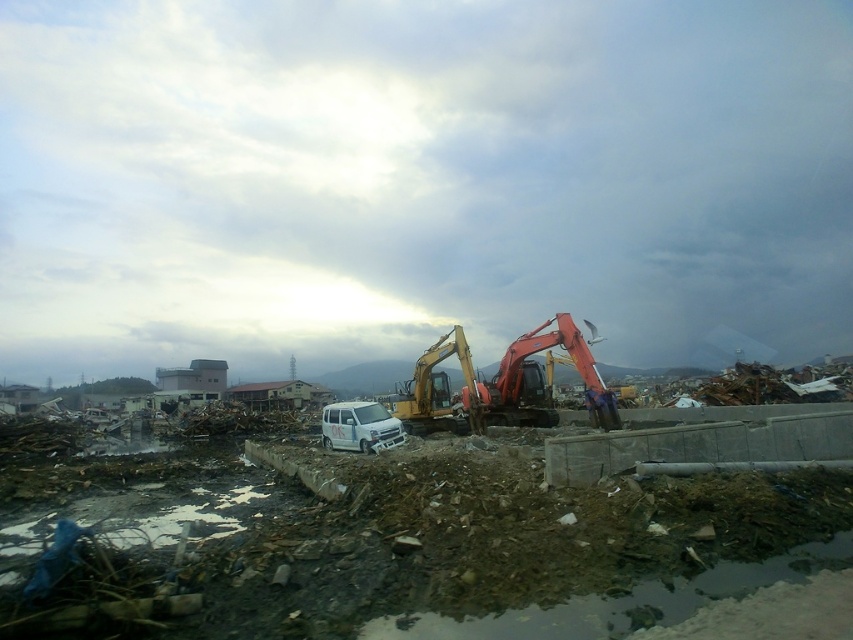
Question: In this image, where is metallic yellow excavator at center located relative to orange metallic excavator at center?

Choices:
 (A) above
 (B) below

Answer: (B)

Question: Which of the following is the farthest from the observer?

Choices:
 (A) [x=509, y=356]
 (B) [x=844, y=541]

Answer: (A)

Question: Does metallic yellow excavator at center appear under orange metallic excavator at center?

Choices:
 (A) yes
 (B) no

Answer: (A)

Question: Which point is closer to the camera taking this photo?

Choices:
 (A) (558, 534)
 (B) (463, 340)

Answer: (A)

Question: Can you confirm if metallic yellow excavator at center is bigger than orange metallic excavator at center?

Choices:
 (A) yes
 (B) no

Answer: (A)

Question: Among these points, which one is nearest to the camera?

Choices:
 (A) (16, 586)
 (B) (610, 394)

Answer: (A)